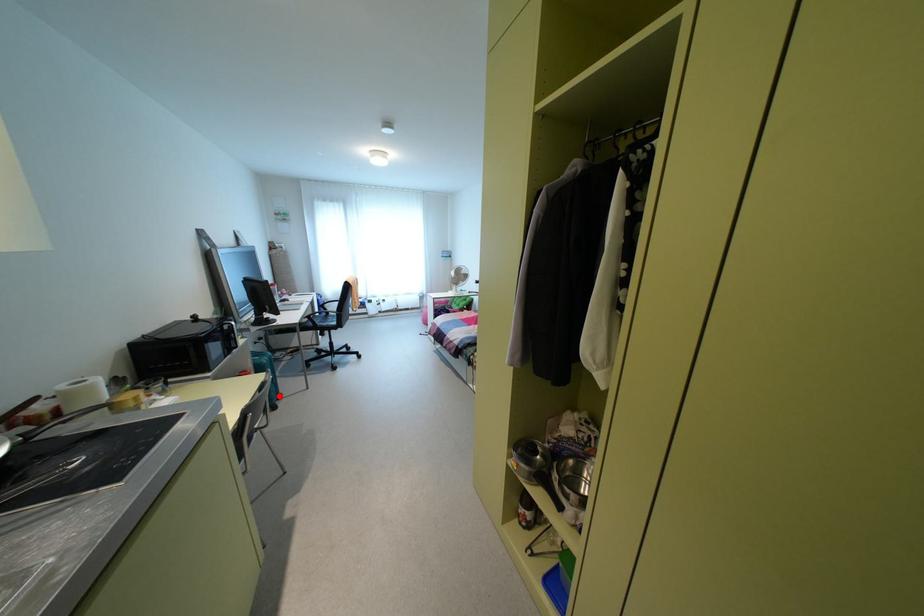
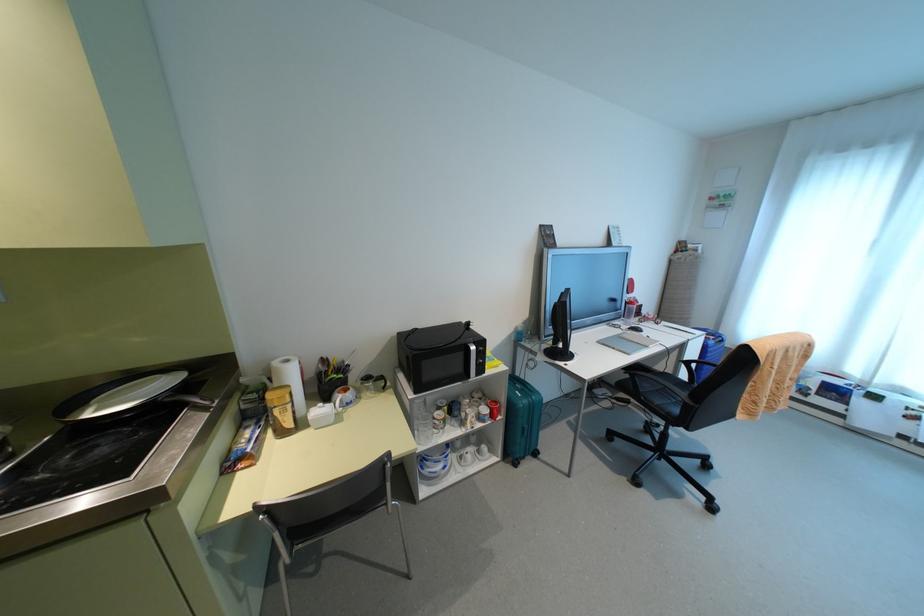
Locate, in the second image, the point that corresponds to the highlighted location in the first image.

(535, 454)